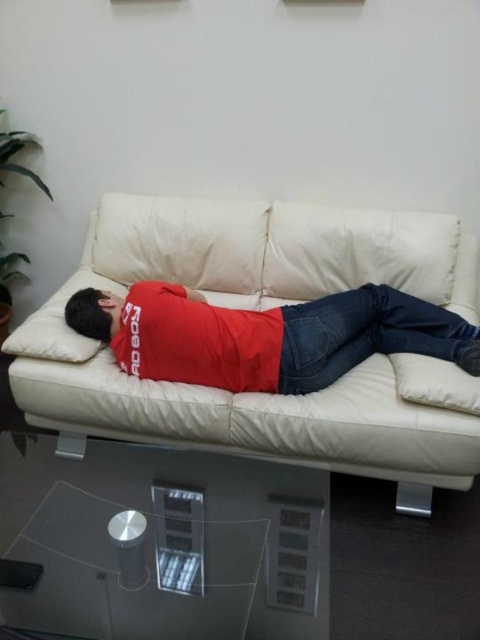
You are a delivery person who needs to place a package on the surface that can hold heavier items. Based on the scene, which object between the transparent glass table at lower center and the matte red shirt at center is more suitable for placing the package?

The transparent glass table at lower center is more suitable for placing the package because it has a larger size compared to the matte red shirt at center, making it capable of supporting heavier items.

You need to place a large potted plant on either the white leather couch at center or the transparent glass table at lower center. Based on their sizes, which surface would be more suitable for the plant?

The white leather couch at center is larger in size than the transparent glass table at lower center, so the white leather couch at center would be more suitable for placing the large potted plant.